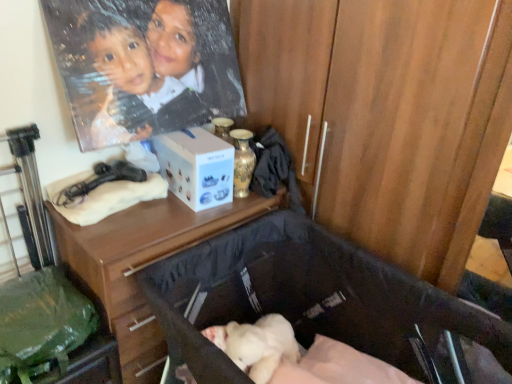
Image resolution: width=512 pixels, height=384 pixels. Describe the element at coordinates (100, 180) in the screenshot. I see `matte black hairdryer at upper left` at that location.

Measure the distance between point (82, 192) and camera.

Point (82, 192) and camera are 1.53 meters apart.

What do you see at coordinates (196, 167) in the screenshot?
I see `white matte box at center` at bounding box center [196, 167].

What is the approximate width of gold metallic vase at upper center?

gold metallic vase at upper center is 4.33 inches wide.

Identify the location of wooden desk at center. The width and height of the screenshot is (512, 384). (143, 264).

Identify the location of matte black hairdryer at upper left. (100, 180).

From the picture: Is wooden desk at center inside or outside of soft black fabric baby carriage at lower center?

wooden desk at center is not enclosed by soft black fabric baby carriage at lower center.

From the image's perspective, is wooden desk at center on soft black fabric baby carriage at lower center?

Correct, wooden desk at center appears higher than soft black fabric baby carriage at lower center in the image.

From the picture: Who is more distant, wooden desk at center or soft black fabric baby carriage at lower center?

wooden desk at center is further away from the camera.

From a real-world perspective, who is located lower, wooden desk at center or soft black fabric baby carriage at lower center?

From a 3D spatial view, soft black fabric baby carriage at lower center is below.

Looking at this image, could you tell me if matte black hairdryer at upper left is facing soft black fabric baby carriage at lower center?

No, matte black hairdryer at upper left is not facing towards soft black fabric baby carriage at lower center.

Based on the photo, does matte black hairdryer at upper left appear on the right side of soft black fabric baby carriage at lower center?

No, matte black hairdryer at upper left is not to the right of soft black fabric baby carriage at lower center.

Is matte black hairdryer at upper left shorter than soft black fabric baby carriage at lower center?

Yes, matte black hairdryer at upper left is shorter than soft black fabric baby carriage at lower center.

From a real-world perspective, is gold metallic vase at upper center located beneath matte black hairdryer at upper left?

No, from a real-world perspective, gold metallic vase at upper center is not below matte black hairdryer at upper left.

Is point (242, 151) closer to viewer compared to point (116, 178)?

That is False.

Would you say gold metallic vase at upper center is inside or outside matte black hairdryer at upper left?

gold metallic vase at upper center lies outside matte black hairdryer at upper left.

How different are the orientations of gold metallic vase at upper center and matte black hairdryer at upper left in degrees?

The angle between the facing direction of gold metallic vase at upper center and the facing direction of matte black hairdryer at upper left is 5.64 degrees.

Is matte black hairdryer at upper left at the back of white matte box at center?

No, white matte box at center is not facing away from matte black hairdryer at upper left.

Can you confirm if white matte box at center is bigger than matte black hairdryer at upper left?

Correct, white matte box at center is larger in size than matte black hairdryer at upper left.

Is point (169, 164) farther from viewer compared to point (125, 178)?

Yes, point (169, 164) is farther from viewer.

Between green fabric bag at lower left and white matte box at center, which one appears on the right side from the viewer's perspective?

white matte box at center.

Is green fabric bag at lower left completely or partially outside of white matte box at center?

That's correct, green fabric bag at lower left is outside of white matte box at center.

Between point (35, 279) and point (174, 147), which one is positioned behind?

The point (174, 147) is farther from the camera.

In the scene shown: Is there a large distance between green fabric bag at lower left and white matte box at center?

green fabric bag at lower left is actually quite close to white matte box at center.

Considering the sizes of objects gold metallic vase at upper center and green fabric bag at lower left in the image provided, who is bigger, gold metallic vase at upper center or green fabric bag at lower left?

Bigger between the two is green fabric bag at lower left.

From a real-world perspective, which is physically above, gold metallic vase at upper center or green fabric bag at lower left?

gold metallic vase at upper center is physically above.

Which is more to the left, gold metallic vase at upper center or green fabric bag at lower left?

green fabric bag at lower left is more to the left.

Is point (244, 186) positioned after point (78, 307)?

Yes, point (244, 186) is behind point (78, 307).

From the image's perspective, is soft black fabric baby carriage at lower center above or below matte black hairdryer at upper left?

Clearly, from the image's perspective, soft black fabric baby carriage at lower center is below matte black hairdryer at upper left.

Between soft black fabric baby carriage at lower center and matte black hairdryer at upper left, which one is positioned behind?

matte black hairdryer at upper left is behind.

Find the location of a particular element. baby carriage in front of the matte black hairdryer at upper left is located at coordinates (306, 297).

Which is behind, point (222, 322) or point (143, 175)?

The point (222, 322) is farther from the camera.

The width and height of the screenshot is (512, 384). In order to click on baby carriage on the right of wooden desk at center in this screenshot , I will do `click(306, 297)`.

In order to click on twin lying behind the soft black fabric baby carriage at lower center in this screenshot , I will do `click(100, 180)`.

Based on the photo, based on their spatial positions, is soft black fabric baby carriage at lower center or white matte box at center closer to green fabric bag at lower left?

soft black fabric baby carriage at lower center is closer to green fabric bag at lower left.

Looking at this image, when comparing their distances from green fabric bag at lower left, does gold metallic vase at upper center or matte black hairdryer at upper left seem closer?

Based on the image, matte black hairdryer at upper left appears to be nearer to green fabric bag at lower left.

Based on their spatial positions, is white matte box at center or gold metallic vase at upper center closer to green fabric bag at lower left?

white matte box at center.

Considering their positions, is matte black hairdryer at upper left positioned further to green fabric bag at lower left than wooden desk at center?

Among the two, matte black hairdryer at upper left is located further to green fabric bag at lower left.

Considering their positions, is wooden desk at center positioned closer to white matte box at center than green fabric bag at lower left?

The object closer to white matte box at center is wooden desk at center.

When comparing their distances from white matte box at center, does green fabric bag at lower left or soft black fabric baby carriage at lower center seem further?

green fabric bag at lower left lies further to white matte box at center than the other object.

Looking at the image, which one is located further to gold metallic vase at upper center, white matte box at center or wooden desk at center?

Among the two, wooden desk at center is located further to gold metallic vase at upper center.

Based on their spatial positions, is green fabric bag at lower left or white matte box at center closer to gold metallic vase at upper center?

white matte box at center is positioned closer to the anchor gold metallic vase at upper center.

Locate an element on the screen. The width and height of the screenshot is (512, 384). desk between gold metallic vase at upper center and green fabric bag at lower left in the up-down direction is located at coordinates [x=143, y=264].

Where is `twin located between soft black fabric baby carriage at lower center and gold metallic vase at upper center in the depth direction`? The image size is (512, 384). twin located between soft black fabric baby carriage at lower center and gold metallic vase at upper center in the depth direction is located at coordinates (100, 180).

Find the location of a particular element. This screenshot has width=512, height=384. bottle that lies between white matte box at center and green fabric bag at lower left from top to bottom is located at coordinates (242, 162).

Identify the location of twin located between green fabric bag at lower left and soft black fabric baby carriage at lower center in the left-right direction. Image resolution: width=512 pixels, height=384 pixels. (100, 180).